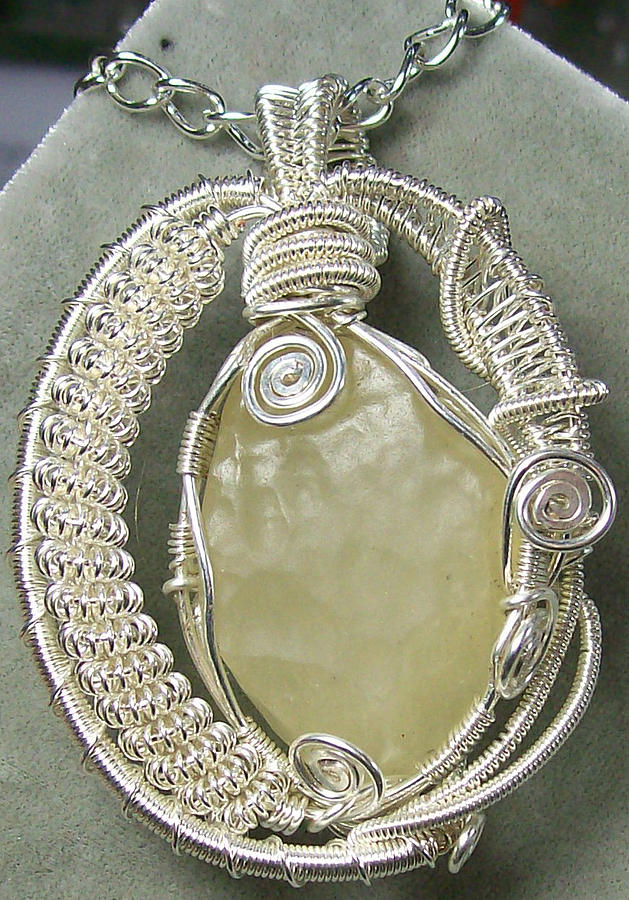
At what (x,y) coordinates should I click in order to perform the action: click on jewelry holder. Please return your answer as a coordinate pair (x, y). Looking at the image, I should click on (563, 130).